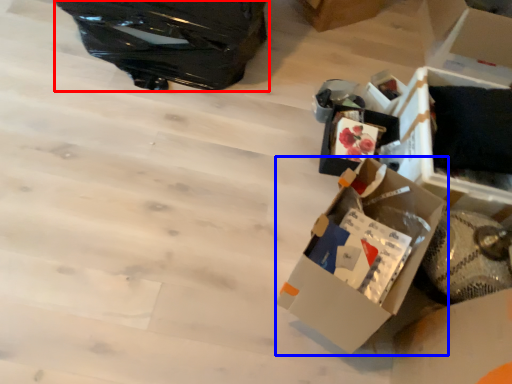
Question: Which object appears closest to the camera in this image, suitcase (highlighted by a red box) or box (highlighted by a blue box)?

Choices:
 (A) suitcase
 (B) box

Answer: (B)